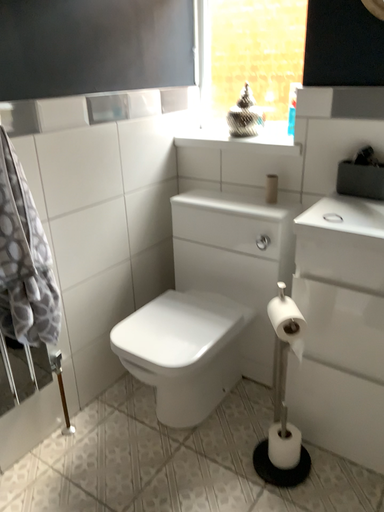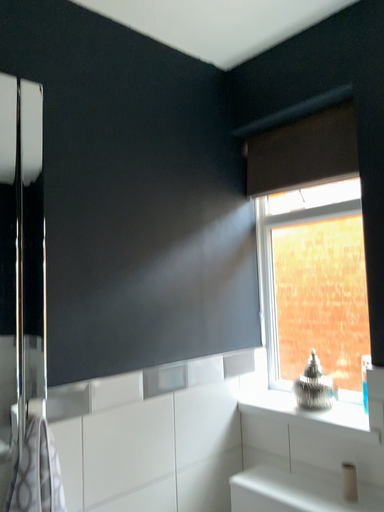
Question: Which way did the camera rotate in the video?

Choices:
 (A) rotated right
 (B) rotated left

Answer: (B)